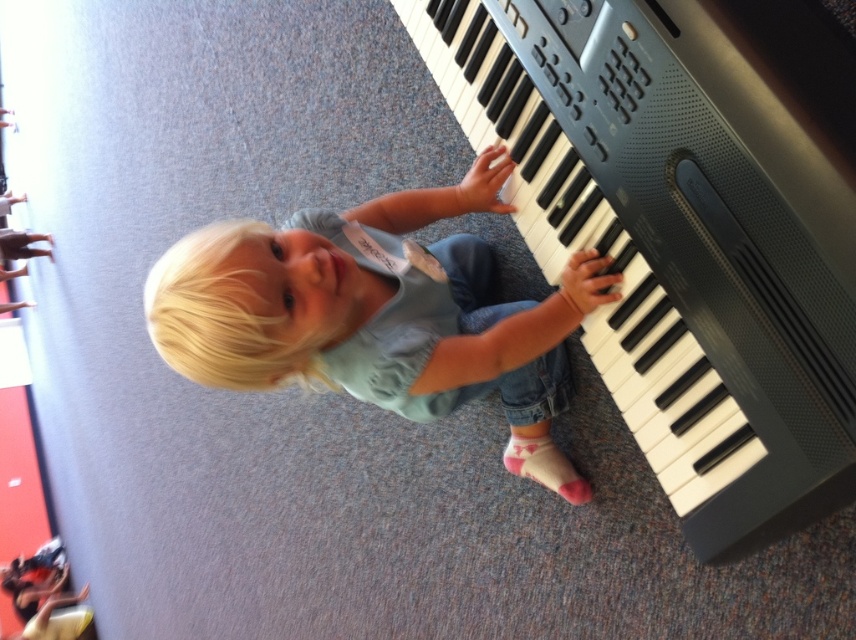
Between black plastic keyboard at right and blonde hair at center, which one has more height?

black plastic keyboard at right

Can you confirm if black plastic keyboard at right is positioned below blonde hair at center?

Incorrect, black plastic keyboard at right is not positioned below blonde hair at center.

Describe the element at coordinates (687, 225) in the screenshot. I see `black plastic keyboard at right` at that location.

Where is `black plastic keyboard at right`? black plastic keyboard at right is located at coordinates (687, 225).